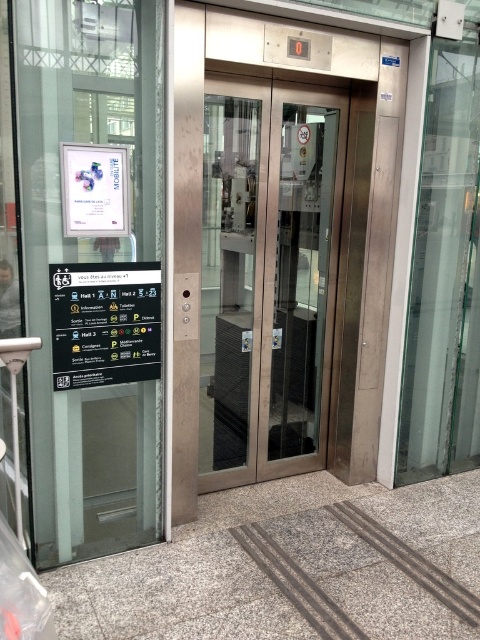
Which is in front, point (54, 81) or point (436, 140)?

Point (54, 81)

Can you confirm if transparent glass door at left is positioned to the right of transparent glass door at right?

No, transparent glass door at left is not to the right of transparent glass door at right.

Which is behind, point (56, 177) or point (409, 276)?

The point (409, 276) is behind.

The width and height of the screenshot is (480, 640). Find the location of `transparent glass door at left`. transparent glass door at left is located at coordinates (92, 268).

Does satin silver elevator doors at center appear on the left side of transparent glass door at right?

Correct, you'll find satin silver elevator doors at center to the left of transparent glass door at right.

This screenshot has height=640, width=480. What are the coordinates of `satin silver elevator doors at center` in the screenshot? It's located at (266, 276).

Identify the location of satin silver elevator doors at center. This screenshot has height=640, width=480. (266, 276).

Looking at this image, does transparent glass door at left have a larger size compared to satin silver elevator doors at center?

Incorrect, transparent glass door at left is not larger than satin silver elevator doors at center.

Which is below, transparent glass door at left or satin silver elevator doors at center?

transparent glass door at left

You are a GUI agent. You are given a task and a screenshot of the screen. Output one action in this format:
    pyautogui.click(x=<x>, y=<y>)
    Task: Click on the transparent glass door at left
    The width and height of the screenshot is (480, 640).
    Given the screenshot: What is the action you would take?
    pyautogui.click(x=92, y=268)

Identify the location of transparent glass door at left. (92, 268).